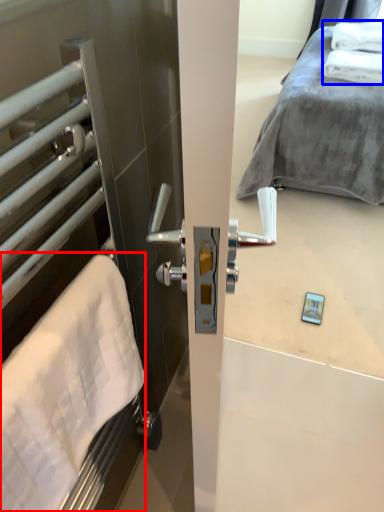
Question: Which of the following is the farthest to the observer, bath towel (highlighted by a red box) or bath towel (highlighted by a blue box)?

Choices:
 (A) bath towel
 (B) bath towel

Answer: (B)